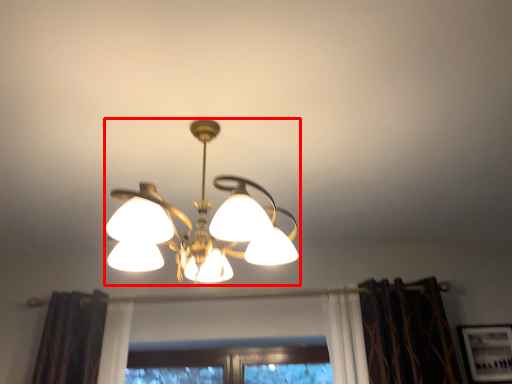
Question: Observing the image, what is the correct spatial positioning of lamp (annotated by the red box) in reference to picture frame?

Choices:
 (A) left
 (B) right

Answer: (A)